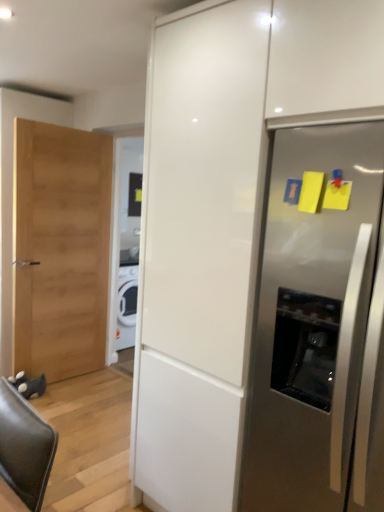
Question: From a real-world perspective, does stainless steel refrigerator at right sit lower than white glossy cabinet at center?

Choices:
 (A) no
 (B) yes

Answer: (B)

Question: Does stainless steel refrigerator at right have a lesser width compared to white glossy cabinet at center?

Choices:
 (A) yes
 (B) no

Answer: (B)

Question: Can you confirm if stainless steel refrigerator at right is bigger than white glossy cabinet at center?

Choices:
 (A) no
 (B) yes

Answer: (A)

Question: Is stainless steel refrigerator at right shorter than white glossy cabinet at center?

Choices:
 (A) yes
 (B) no

Answer: (A)

Question: Can you confirm if stainless steel refrigerator at right is positioned to the right of white glossy cabinet at center?

Choices:
 (A) yes
 (B) no

Answer: (A)

Question: Can we say stainless steel refrigerator at right lies outside white glossy cabinet at center?

Choices:
 (A) yes
 (B) no

Answer: (B)

Question: From a real-world perspective, is white glossy cabinet at center under stainless steel refrigerator at right?

Choices:
 (A) no
 (B) yes

Answer: (A)

Question: Is white glossy cabinet at center facing away from stainless steel refrigerator at right?

Choices:
 (A) yes
 (B) no

Answer: (A)

Question: From the image's perspective, is white glossy cabinet at center below stainless steel refrigerator at right?

Choices:
 (A) no
 (B) yes

Answer: (A)

Question: Does white glossy cabinet at center have a greater width compared to stainless steel refrigerator at right?

Choices:
 (A) yes
 (B) no

Answer: (B)

Question: Is white glossy cabinet at center closer to the viewer compared to stainless steel refrigerator at right?

Choices:
 (A) yes
 (B) no

Answer: (A)

Question: Is white glossy cabinet at center to the right of stainless steel refrigerator at right from the viewer's perspective?

Choices:
 (A) no
 (B) yes

Answer: (A)

Question: From the image's perspective, is stainless steel refrigerator at right above or below white glossy cabinet at center?

Choices:
 (A) below
 (B) above

Answer: (A)